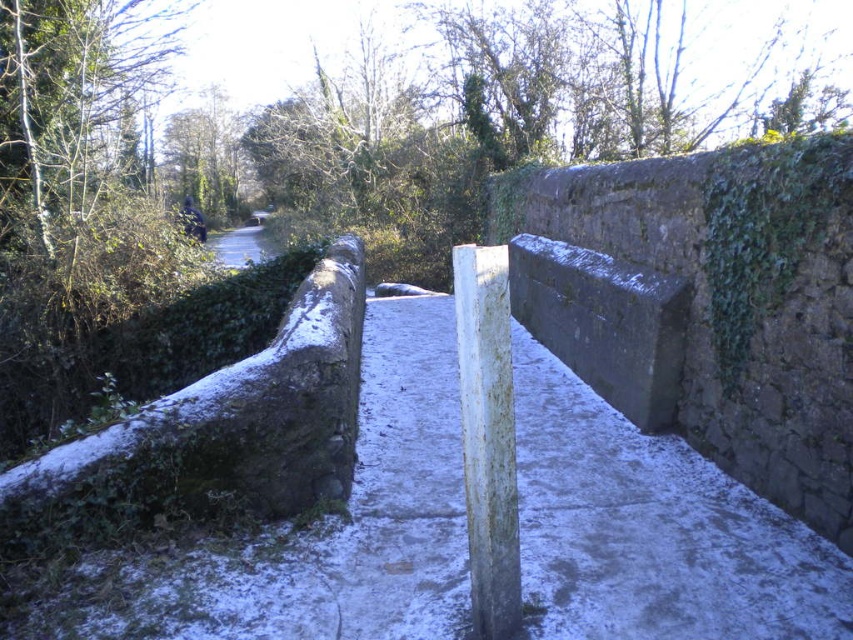
Which is above, gray stone barrier at center or white weathered wood post at center?

gray stone barrier at center is higher up.

What do you see at coordinates (604, 323) in the screenshot? The height and width of the screenshot is (640, 853). I see `gray stone barrier at center` at bounding box center [604, 323].

Which is in front, point (660, 422) or point (506, 513)?

Point (506, 513) is in front.

The height and width of the screenshot is (640, 853). What are the coordinates of `gray stone barrier at center` in the screenshot? It's located at (604, 323).